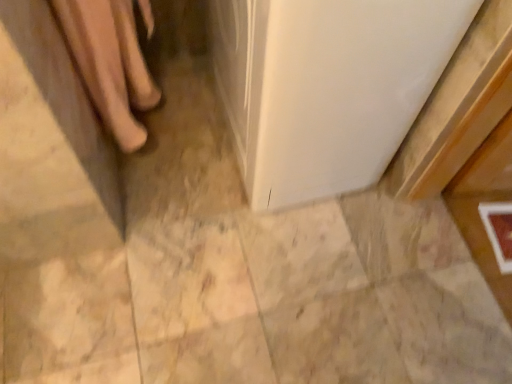
Measure the distance between wooden chopsticks at upper left and camera.

wooden chopsticks at upper left is 31.61 inches from camera.

What do you see at coordinates (110, 63) in the screenshot?
I see `wooden chopsticks at upper left` at bounding box center [110, 63].

Locate an element on the screen. This screenshot has width=512, height=384. wooden chopsticks at upper left is located at coordinates (110, 63).

At what (x,y) coordinates should I click in order to perform the action: click on wooden chopsticks at upper left. Please return your answer as a coordinate pair (x, y). Looking at the image, I should click on (110, 63).